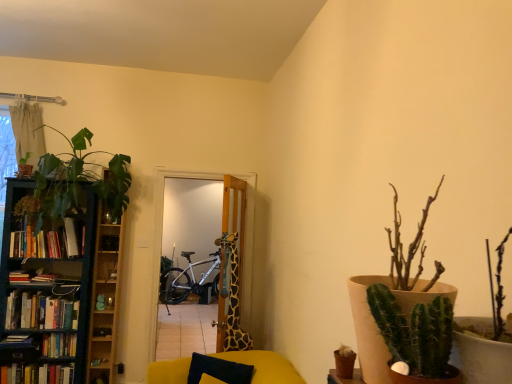
Question: From the image's perspective, does green spiky cactus at right, which appears as the 1th houseplant when viewed from the front, appear lower than wooden cabinet at left?

Choices:
 (A) no
 (B) yes

Answer: (A)

Question: Considering the relative sizes of green spiky cactus at right, the 1th houseplant when ordered from right to left, and wooden cabinet at left in the image provided, is green spiky cactus at right, the 1th houseplant when ordered from right to left, wider than wooden cabinet at left?

Choices:
 (A) yes
 (B) no

Answer: (B)

Question: Could you tell me if green spiky cactus at right, the 1th houseplant when ordered from right to left, is facing wooden cabinet at left?

Choices:
 (A) no
 (B) yes

Answer: (A)

Question: Is green spiky cactus at right, which is the 3th houseplant from back to front, at the left side of wooden cabinet at left?

Choices:
 (A) no
 (B) yes

Answer: (A)

Question: Are green spiky cactus at right, which appears as the 1th houseplant when viewed from the front, and wooden cabinet at left far apart?

Choices:
 (A) yes
 (B) no

Answer: (A)

Question: Is green spiky cactus at right, which ranks as the third houseplant in left-to-right order, to the right of wooden cabinet at left from the viewer's perspective?

Choices:
 (A) no
 (B) yes

Answer: (B)

Question: Does green leafy plant at left, marked as the 2th houseplant in a back-to-front arrangement, have a larger size compared to green spiky cactus at right, which is the 3th houseplant from back to front?

Choices:
 (A) no
 (B) yes

Answer: (B)

Question: Can you confirm if green leafy plant at left, the 2th houseplant viewed from the right, is positioned to the left of green spiky cactus at right, which appears as the 1th houseplant when viewed from the front?

Choices:
 (A) no
 (B) yes

Answer: (B)

Question: Does green leafy plant at left, which ranks as the 2th houseplant in left-to-right order, have a lesser width compared to green spiky cactus at right, the 1th houseplant when ordered from right to left?

Choices:
 (A) yes
 (B) no

Answer: (B)

Question: Is green leafy plant at left, the 2th houseplant from the front, positioned behind green spiky cactus at right, which ranks as the third houseplant in left-to-right order?

Choices:
 (A) yes
 (B) no

Answer: (A)

Question: From the image's perspective, does green leafy plant at left, the 2th houseplant from the front, appear higher than green spiky cactus at right, which is the 3th houseplant from back to front?

Choices:
 (A) yes
 (B) no

Answer: (A)

Question: Is green leafy plant at left, which ranks as the 2th houseplant in left-to-right order, surrounding green spiky cactus at right, which is the 3th houseplant from back to front?

Choices:
 (A) yes
 (B) no

Answer: (B)

Question: Is green leafy plant at left, the 2th houseplant from the front, aimed at green leafy plant at upper left, the third houseplant when ordered from right to left?

Choices:
 (A) no
 (B) yes

Answer: (A)